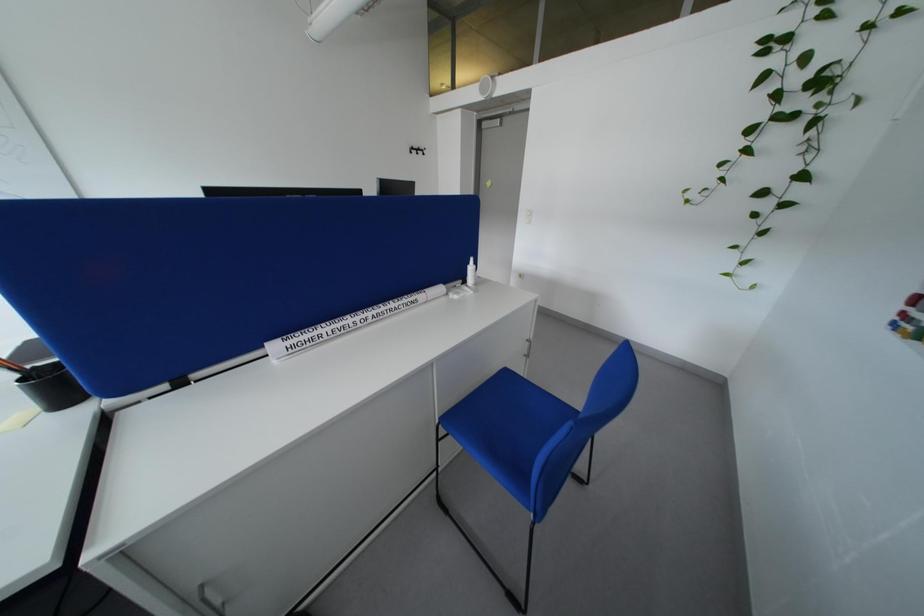
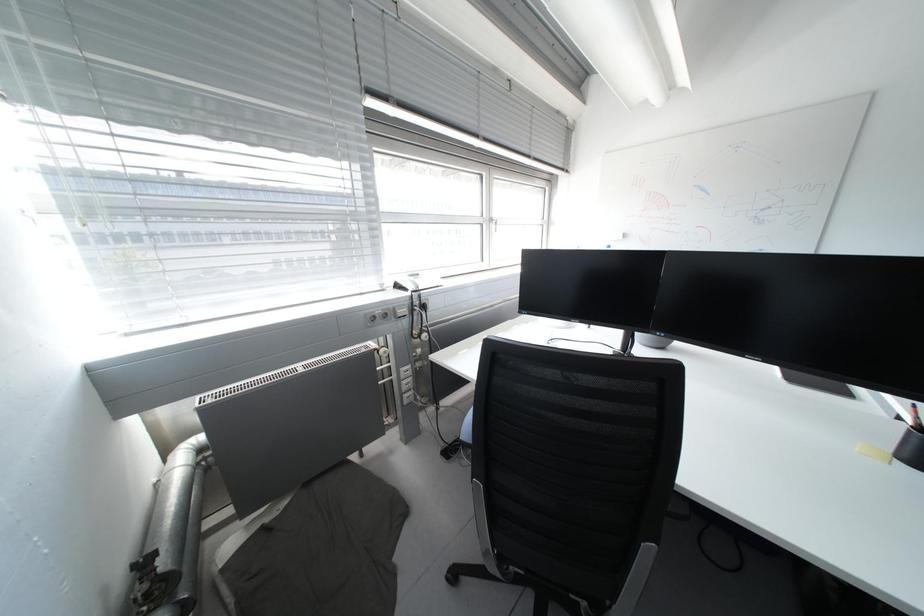
How did the camera likely rotate?

The camera's rotation is toward left-down.